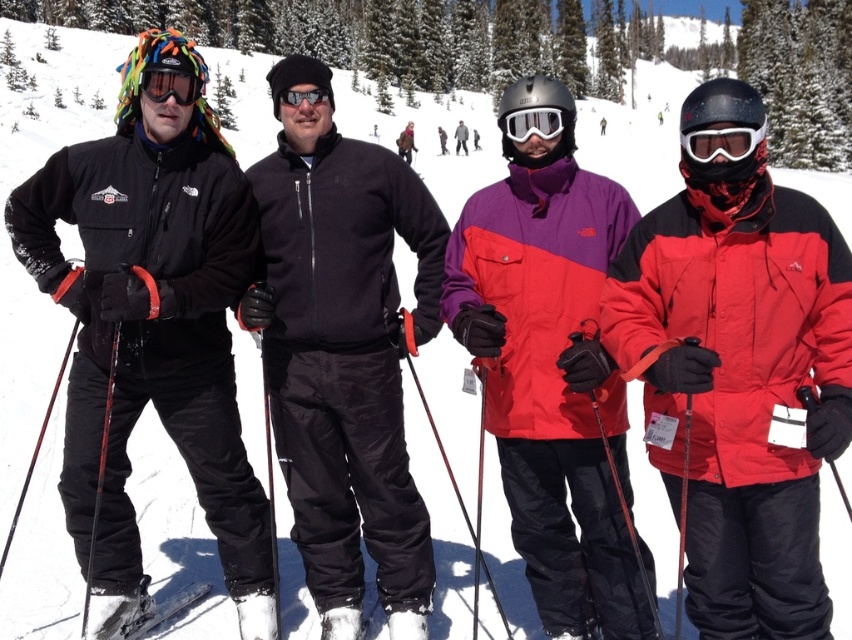
Question: Does black fleece jacket at center have a smaller size compared to matte purple-red ski jacket at center?

Choices:
 (A) yes
 (B) no

Answer: (B)

Question: Estimate the real-world distances between objects in this image. Which object is farther from the glossy plastic goggles at center?

Choices:
 (A) white matte ski at lower left
 (B) white matte ski goggles at center
 (C) black matte goggles at center
 (D) matte purple-red ski jacket at center

Answer: (A)

Question: Which object is positioned farthest from the glossy plastic goggles at center?

Choices:
 (A) black fleece jacket at center
 (B) white matte ski at lower left
 (C) black matte goggles at center
 (D) matte black goggles at left

Answer: (B)

Question: Is white matte ski at lower left further to the viewer compared to white matte ski goggles at center?

Choices:
 (A) no
 (B) yes

Answer: (B)

Question: Is glossy plastic goggles at center closer to camera compared to matte black goggles at left?

Choices:
 (A) yes
 (B) no

Answer: (A)

Question: Which point is farther to the camera?

Choices:
 (A) white matte ski goggles at center
 (B) black matte goggles at center

Answer: (B)